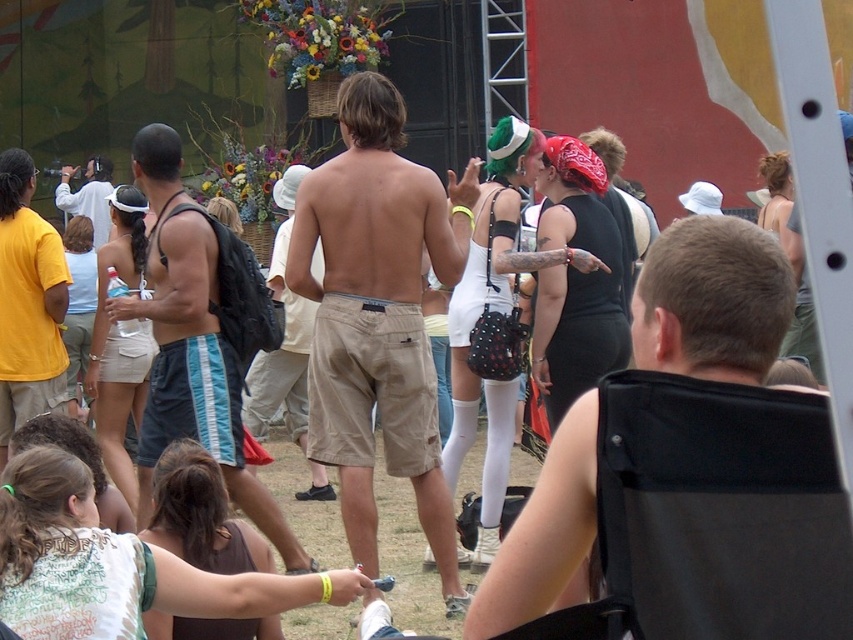
You are standing at the point labeled point (51, 259) and want to move towards the stage located at the back of the image. Is the point labeled point (570, 465) in your direct path towards the stage?

Point (570, 465) is closer to the camera than point (51, 259). Therefore, the point (570, 465) is not in your direct path towards the stage since it is behind your current position.

You are standing at the center of the image and want to find the blue striped shorts at center. According to the coordinates provided, in which direction should you look to locate them?

The blue striped shorts at center are located at coordinates point (190, 346). Since you are at the center, which is typically considered as point (426, 320) in a normalized coordinate system, the shorts are slightly to the right and below your current position. Therefore, you should look to your lower right direction to locate them.